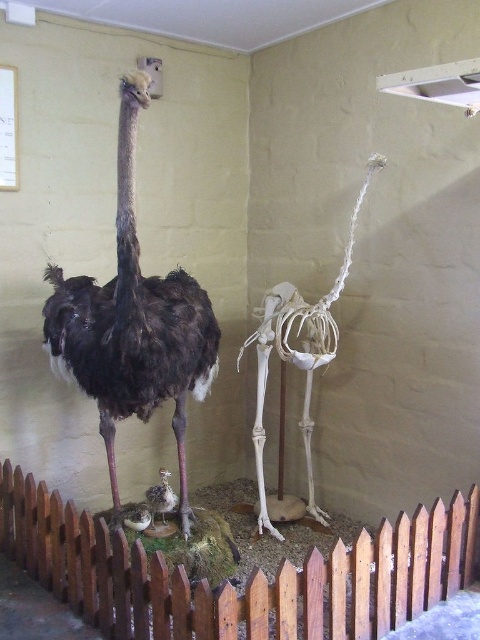
Question: Which point is closer to the camera taking this photo?

Choices:
 (A) (109, 321)
 (B) (119, 531)

Answer: (B)

Question: Is brown wooden picket fence at lower center above brown feathered chick at center?

Choices:
 (A) yes
 (B) no

Answer: (B)

Question: Is dark brown feathers at center bigger than brown feathered chick at center?

Choices:
 (A) no
 (B) yes

Answer: (B)

Question: Does brown wooden picket fence at lower center have a lesser width compared to dark brown feathers at center?

Choices:
 (A) yes
 (B) no

Answer: (B)

Question: Which of these objects is positioned farthest from the dark brown feathers at center?

Choices:
 (A) brown feathered chick at center
 (B) brown wooden picket fence at lower center

Answer: (B)

Question: Which object appears closest to the camera in this image?

Choices:
 (A) brown feathered chick at center
 (B) dark brown feathers at center
 (C) brown wooden picket fence at lower center

Answer: (C)